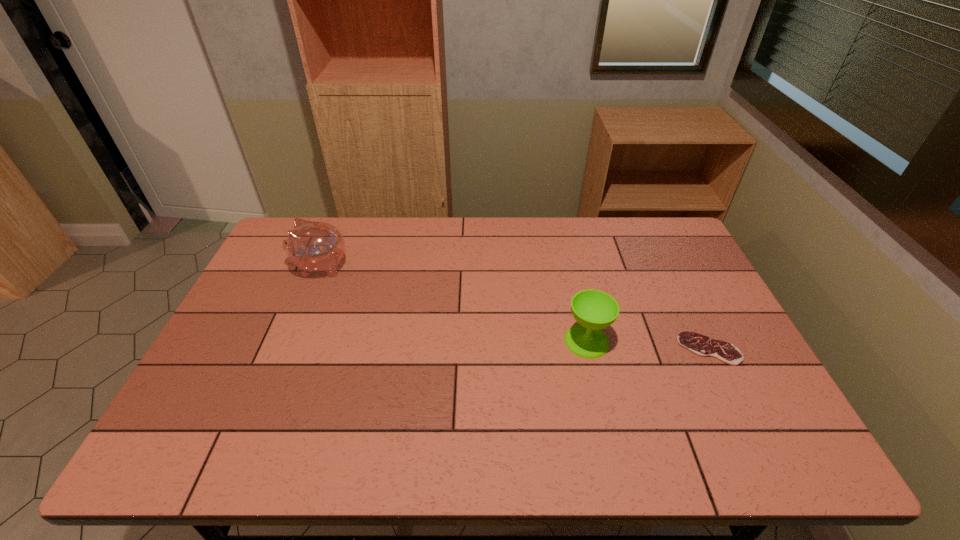
The image size is (960, 540). Identify the location of empty space that is in between the wineglass and the rightmost object. (648, 345).

Identify the location of vacant area that lies between the steak and the farthest object. The height and width of the screenshot is (540, 960). (x=515, y=307).

Find the location of a particular element. The width and height of the screenshot is (960, 540). empty space that is in between the shortest object and the wineglass is located at coordinates (648, 345).

The image size is (960, 540). I want to click on free space between the shortest object and the second shortest object, so click(648, 345).

Identify the location of free space between the rightmost object and the second shortest object. (648, 345).

Where is `empty space between the wineglass and the piggy bank`? The height and width of the screenshot is (540, 960). empty space between the wineglass and the piggy bank is located at coordinates (453, 303).

Locate an element on the screen. This screenshot has height=540, width=960. vacant space that's between the second shortest object and the tallest object is located at coordinates (453, 303).

Find the location of `vacant area that lies between the rightmost object and the second object from left to right`. vacant area that lies between the rightmost object and the second object from left to right is located at coordinates (648, 345).

At what (x,y) coordinates should I click in order to perform the action: click on object that is the second closest one to the steak. Please return your answer as a coordinate pair (x, y). The width and height of the screenshot is (960, 540). Looking at the image, I should click on (312, 246).

I want to click on object that stands as the second closest to the wineglass, so click(x=312, y=246).